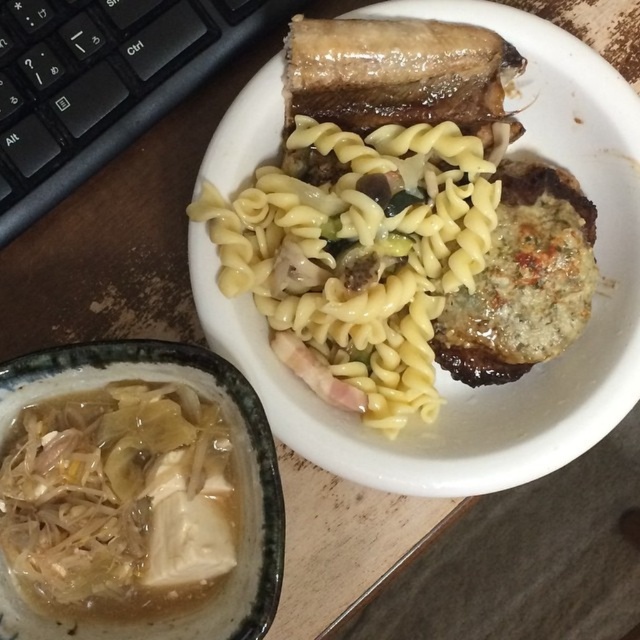
Question: Does yellow matte pasta at upper center have a smaller size compared to translucent white broth at lower left?

Choices:
 (A) no
 (B) yes

Answer: (A)

Question: Which point is closer to the camera?

Choices:
 (A) translucent white broth at lower left
 (B) yellow glossy pasta at center
 (C) yellow matte pasta at upper center

Answer: (A)

Question: Is yellow glossy pasta at center thinner than translucent white broth at lower left?

Choices:
 (A) no
 (B) yes

Answer: (A)

Question: Among these objects, which one is nearest to the camera?

Choices:
 (A) yellow matte pasta at upper center
 (B) yellow glossy pasta at center

Answer: (A)

Question: Among these points, which one is farthest from the camera?

Choices:
 (A) (442, 490)
 (B) (372, 342)
 (C) (170, 509)

Answer: (B)

Question: Can you confirm if yellow matte pasta at upper center is positioned below translucent white broth at lower left?

Choices:
 (A) no
 (B) yes

Answer: (A)